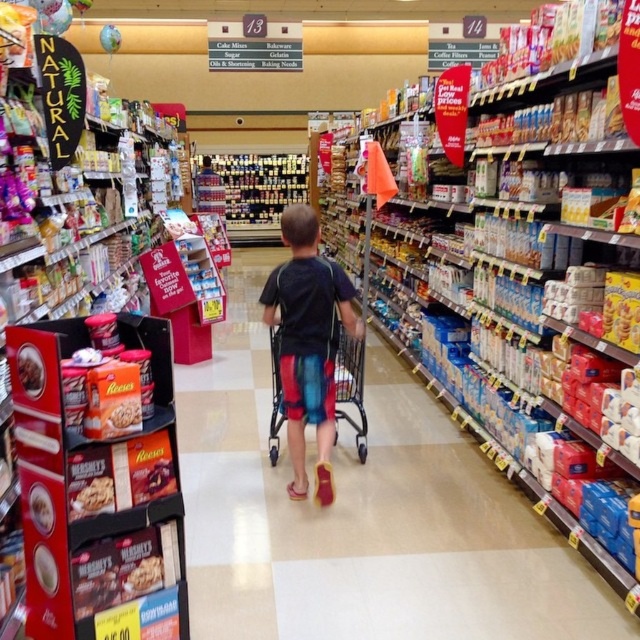
Question: Is matte black shirt at center smaller than metallic silver shopping cart at center?

Choices:
 (A) no
 (B) yes

Answer: (A)

Question: Where is metallic silver shopping cart at center located in relation to smooth chocolate bar at lower left in the image?

Choices:
 (A) right
 (B) left

Answer: (A)

Question: Which of the following is the closest to the observer?

Choices:
 (A) (93, 508)
 (B) (269, 440)
 (C) (134, 588)
 (D) (282, 337)

Answer: (A)

Question: Can you confirm if matte black shirt at center is bigger than metallic silver shopping cart at center?

Choices:
 (A) yes
 (B) no

Answer: (A)

Question: Which point appears farthest from the camera in this image?

Choices:
 (A) (141, 561)
 (B) (80, 513)
 (C) (275, 442)
 (D) (292, 314)

Answer: (C)

Question: Which of the following is the farthest from the observer?

Choices:
 (A) smooth chocolate bar at lower left
 (B) matte black shirt at center

Answer: (B)